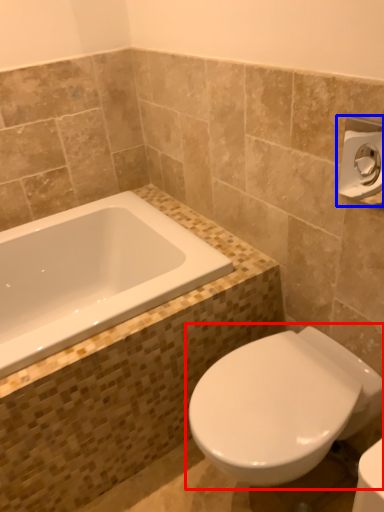
Question: Which object appears farthest to the camera in this image, toilet (highlighted by a red box) or towel bar (highlighted by a blue box)?

Choices:
 (A) toilet
 (B) towel bar

Answer: (A)